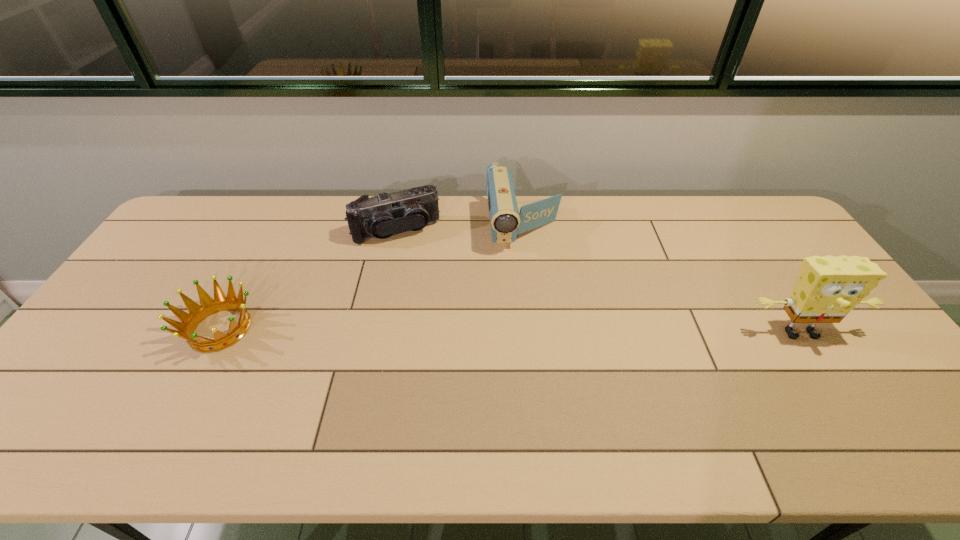
Find the location of a particular element. This screenshot has height=540, width=960. vacant space that's between the rightmost object and the second shortest object is located at coordinates (598, 281).

Identify the location of vacant space in between the third tallest object and the crown. (308, 280).

At what (x,y) coordinates should I click in order to perform the action: click on object that ranks as the closest to the tallest object. Please return your answer as a coordinate pair (x, y). Image resolution: width=960 pixels, height=540 pixels. Looking at the image, I should click on (506, 222).

At what (x,y) coordinates should I click in order to perform the action: click on object that is the third closest to the crown. Please return your answer as a coordinate pair (x, y). This screenshot has width=960, height=540. Looking at the image, I should click on (828, 288).

Where is `vacant point that satisfies the following two spatial constraints: 1. on the back side of the shortest object; 2. on the left side of the left camcorder`? vacant point that satisfies the following two spatial constraints: 1. on the back side of the shortest object; 2. on the left side of the left camcorder is located at coordinates click(272, 231).